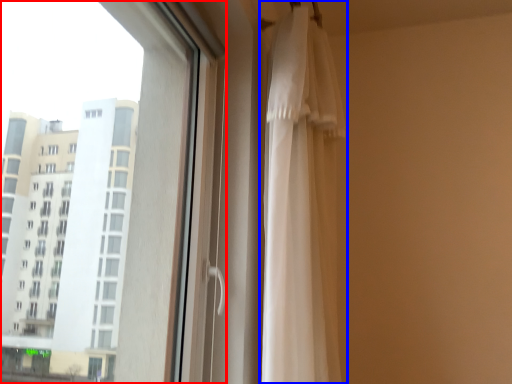
Question: Which object appears farthest to the camera in this image, window (highlighted by a red box) or curtain (highlighted by a blue box)?

Choices:
 (A) window
 (B) curtain

Answer: (B)